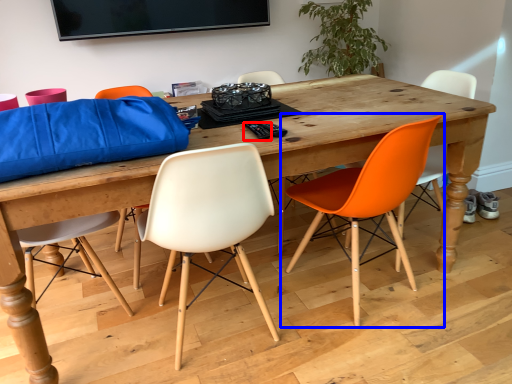
Question: Which point is closer to the camera, remote control (highlighted by a red box) or chair (highlighted by a blue box)?

Choices:
 (A) remote control
 (B) chair

Answer: (B)